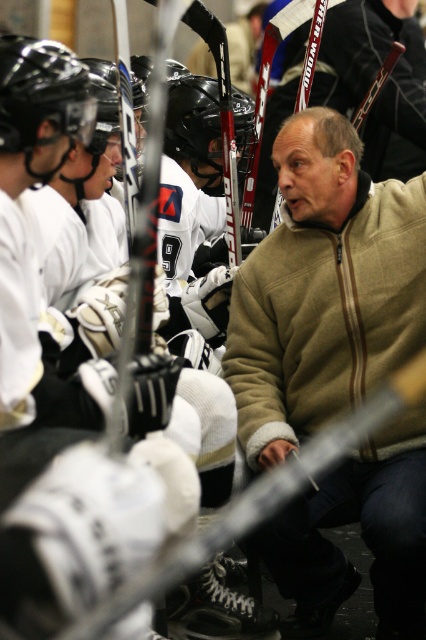
Describe the element at coordinates (324, 289) in the screenshot. The height and width of the screenshot is (640, 426). I see `beige fleece jacket at center` at that location.

Does point (291, 314) lie behind point (210, 189)?

No, (291, 314) is in front of (210, 189).

Which is behind, point (319, 422) or point (181, 113)?

Positioned behind is point (181, 113).

Locate an element on the screen. This screenshot has height=640, width=426. beige fleece jacket at center is located at coordinates (324, 289).

Where is `beige fleece jacket at center`? The image size is (426, 640). beige fleece jacket at center is located at coordinates pos(324,289).

Where is `beige fleece jacket at center`? This screenshot has width=426, height=640. beige fleece jacket at center is located at coordinates click(324, 289).

Who is positioned more to the left, black matte helmet at left or black matte helmet at center?

A: Positioned to the left is black matte helmet at left.

Between black matte helmet at left and black matte helmet at center, which one appears on the right side from the viewer's perspective?

From the viewer's perspective, black matte helmet at center appears more on the right side.

Which is behind, point (60, 60) or point (213, 184)?

Positioned behind is point (213, 184).

This screenshot has height=640, width=426. In order to click on black matte helmet at left in this screenshot , I will do `click(40, 93)`.